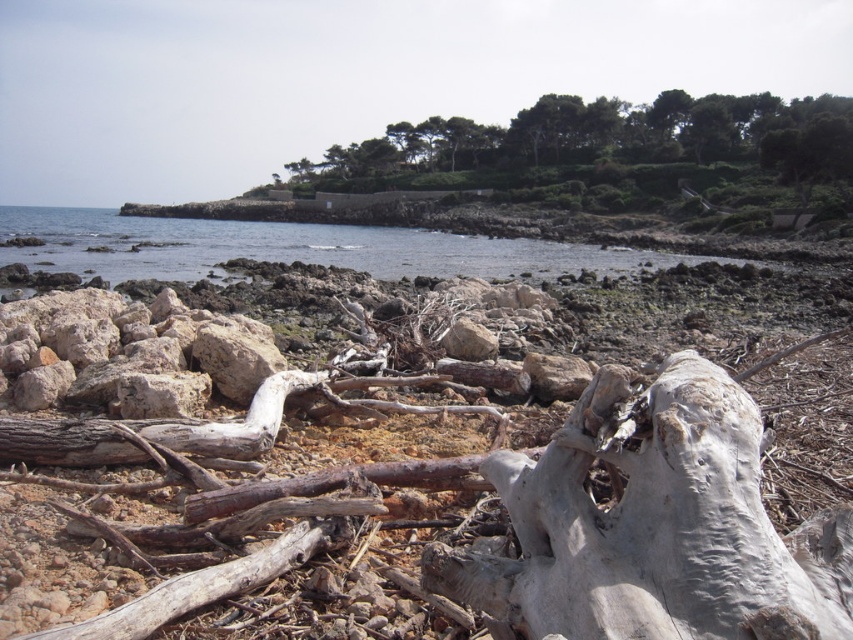
Who is shorter, white weathered wood at center or clear blue water at center?

white weathered wood at center

Who is lower down, white weathered wood at center or clear blue water at center?

Positioned lower is white weathered wood at center.

Describe the element at coordinates (654, 525) in the screenshot. I see `white weathered wood at center` at that location.

Identify the location of white weathered wood at center. The width and height of the screenshot is (853, 640). 654,525.

Does green leafy trees at upper center appear over clear blue water at center?

Indeed, green leafy trees at upper center is positioned over clear blue water at center.

This screenshot has width=853, height=640. What do you see at coordinates (601, 145) in the screenshot?
I see `green leafy trees at upper center` at bounding box center [601, 145].

Image resolution: width=853 pixels, height=640 pixels. Find the location of `green leafy trees at upper center`. green leafy trees at upper center is located at coordinates (601, 145).

Is white weathered wood at center shorter than green leafy trees at upper center?

Indeed, white weathered wood at center has a lesser height compared to green leafy trees at upper center.

In the scene shown: Can you confirm if white weathered wood at center is positioned to the left of green leafy trees at upper center?

Yes, white weathered wood at center is to the left of green leafy trees at upper center.

Which is in front, point (535, 477) or point (485, 131)?

Point (535, 477)

At what (x,y) coordinates should I click in order to perform the action: click on white weathered wood at center. Please return your answer as a coordinate pair (x, y). Image resolution: width=853 pixels, height=640 pixels. Looking at the image, I should click on (654, 525).